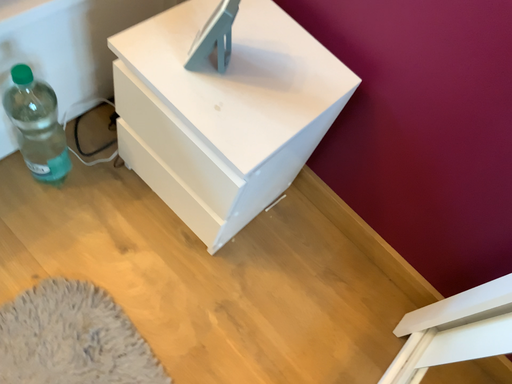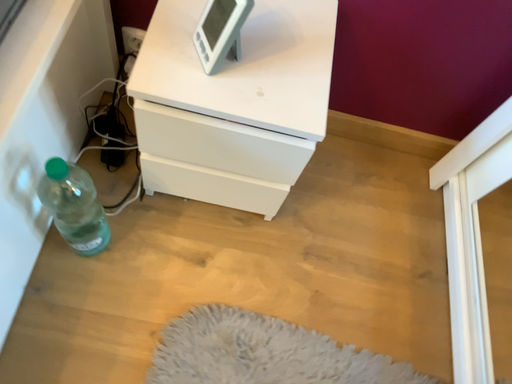
Question: Which way did the camera rotate in the video?

Choices:
 (A) rotated left
 (B) rotated right

Answer: (B)